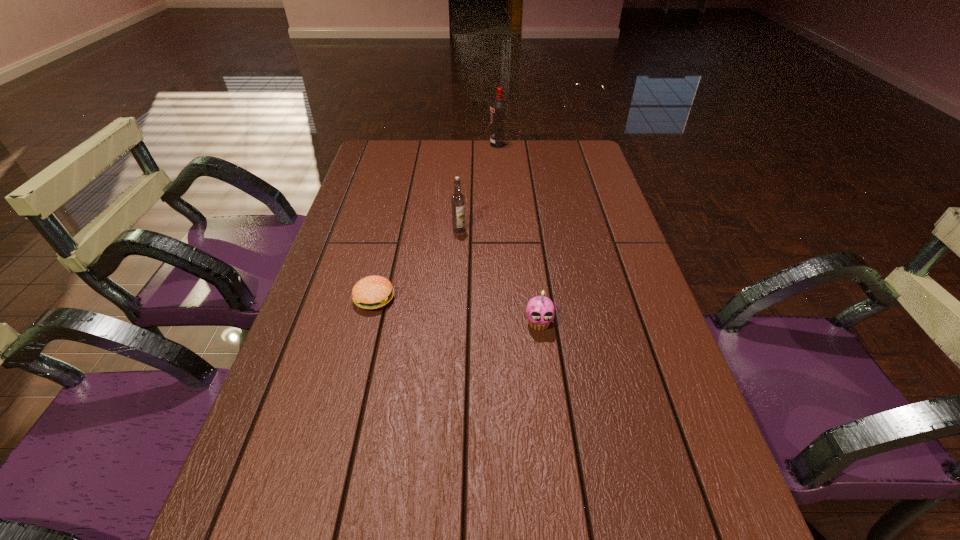
You are a GUI agent. You are given a task and a screenshot of the screen. Output one action in this format:
    pyautogui.click(x=<x>, y=<y>)
    Task: Click on the vacant area that lies between the right vodka and the rightmost object
    This screenshot has width=960, height=540.
    Given the screenshot: What is the action you would take?
    pyautogui.click(x=518, y=234)

Where is `free point between the leftmost object and the farther vodka`? The image size is (960, 540). free point between the leftmost object and the farther vodka is located at coordinates (437, 221).

I want to click on blank region between the cupcake and the farther vodka, so click(518, 234).

Locate an element on the screen. free space between the right vodka and the cupcake is located at coordinates (518, 234).

Locate an element on the screen. empty space that is in between the left vodka and the third tallest object is located at coordinates coord(499,276).

Image resolution: width=960 pixels, height=540 pixels. Find the location of `free space that is in between the second object from left to right and the farther vodka`. free space that is in between the second object from left to right and the farther vodka is located at coordinates (479, 187).

At what (x,y) coordinates should I click in order to perform the action: click on free area in between the left vodka and the taller vodka. Please return your answer as a coordinate pair (x, y). Image resolution: width=960 pixels, height=540 pixels. Looking at the image, I should click on (479, 187).

The width and height of the screenshot is (960, 540). I want to click on free space between the shortest object and the second tallest object, so click(417, 264).

Locate an element on the screen. empty space between the tallest object and the patty is located at coordinates click(x=437, y=221).

Where is `vacant area between the shortest object and the nearer vodka`? The image size is (960, 540). vacant area between the shortest object and the nearer vodka is located at coordinates (417, 264).